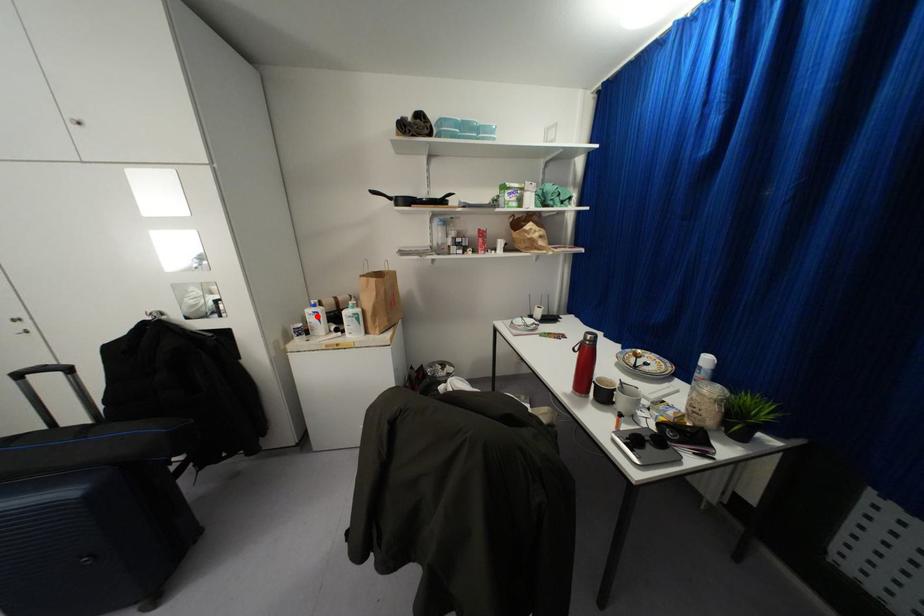
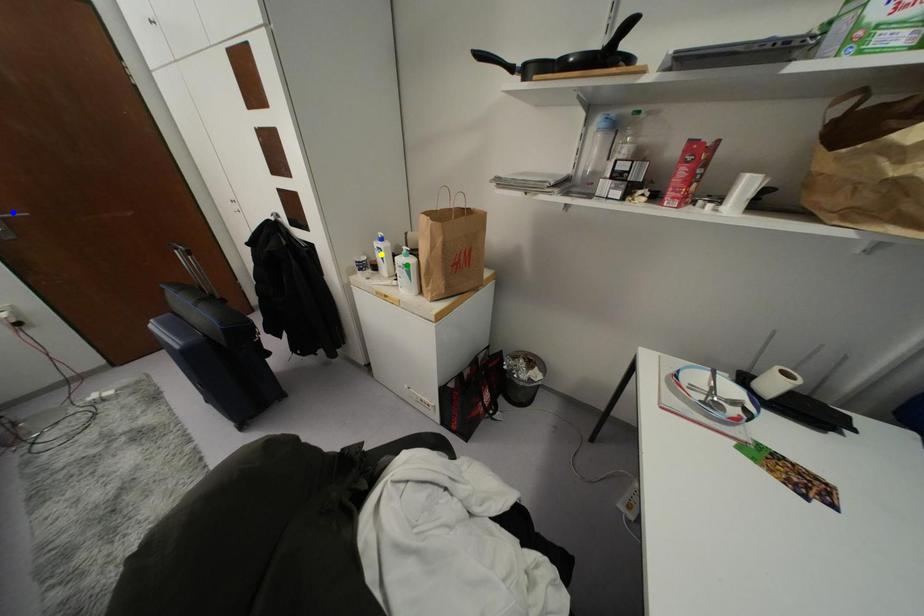
Question: I am providing you with two images of the same scene from different viewpoints. A red point is marked on the first image. You are given multiple points on the second image. Can you choose the point in image 2 that corresponds to the point in image 1?

Choices:
 (A) blue point
 (B) yellow point
 (C) green point

Answer: (B)